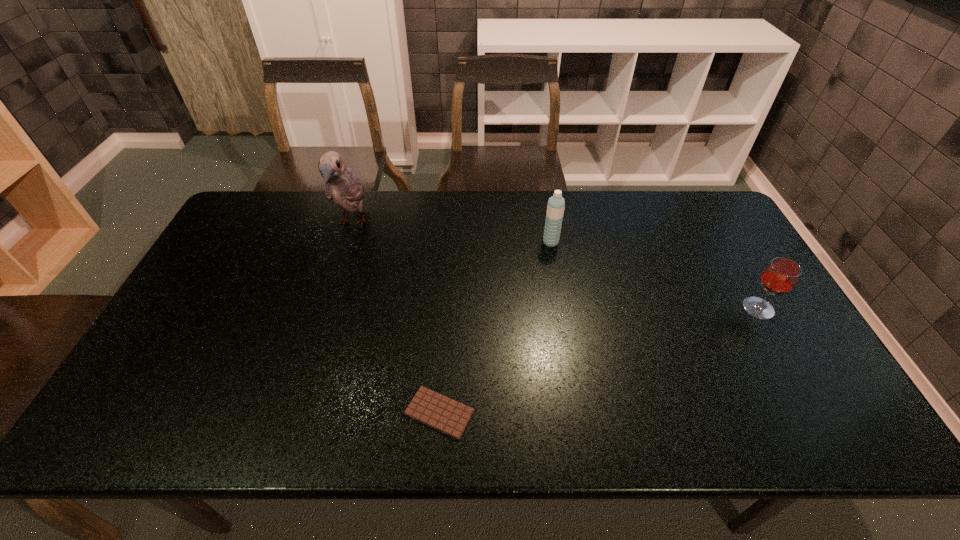
Identify which object is the third closest to the leftmost object. Please provide its 2D coordinates. Your answer should be formatted as a tuple, i.e. [(x, y)], where the tuple contains the x and y coordinates of a point satisfying the conditions above.

[(781, 275)]

Locate an element on the screen. free space that satisfies the following two spatial constraints: 1. on the front-facing side of the tallest object; 2. on the right side of the third object from right to left is located at coordinates (294, 413).

In order to click on vacant space that satisfies the following two spatial constraints: 1. on the back side of the second object from left to right; 2. on the right side of the second nearest object in this screenshot , I will do `click(446, 308)`.

At what (x,y) coordinates should I click in order to perform the action: click on vacant space that satisfies the following two spatial constraints: 1. on the front-facing side of the tallest object; 2. on the left side of the wineglass. Please return your answer as a coordinate pair (x, y). Looking at the image, I should click on 326,308.

You are a GUI agent. You are given a task and a screenshot of the screen. Output one action in this format:
    pyautogui.click(x=<x>, y=<y>)
    Task: Click on the vacant point that satisfies the following two spatial constraints: 1. on the back side of the third shortest object; 2. on the left side of the second object from left to right
    The width and height of the screenshot is (960, 540).
    Given the screenshot: What is the action you would take?
    pyautogui.click(x=451, y=242)

You are a GUI agent. You are given a task and a screenshot of the screen. Output one action in this format:
    pyautogui.click(x=<x>, y=<y>)
    Task: Click on the vacant region that satisfies the following two spatial constraints: 1. on the front-facing side of the leftmost object; 2. on the left side of the second shortest object
    
    Given the screenshot: What is the action you would take?
    pyautogui.click(x=326, y=308)

The image size is (960, 540). What are the coordinates of `vacant space that satisfies the following two spatial constraints: 1. on the front-facing side of the rightmost object; 2. on the left side of the tallest object` in the screenshot? It's located at (326, 308).